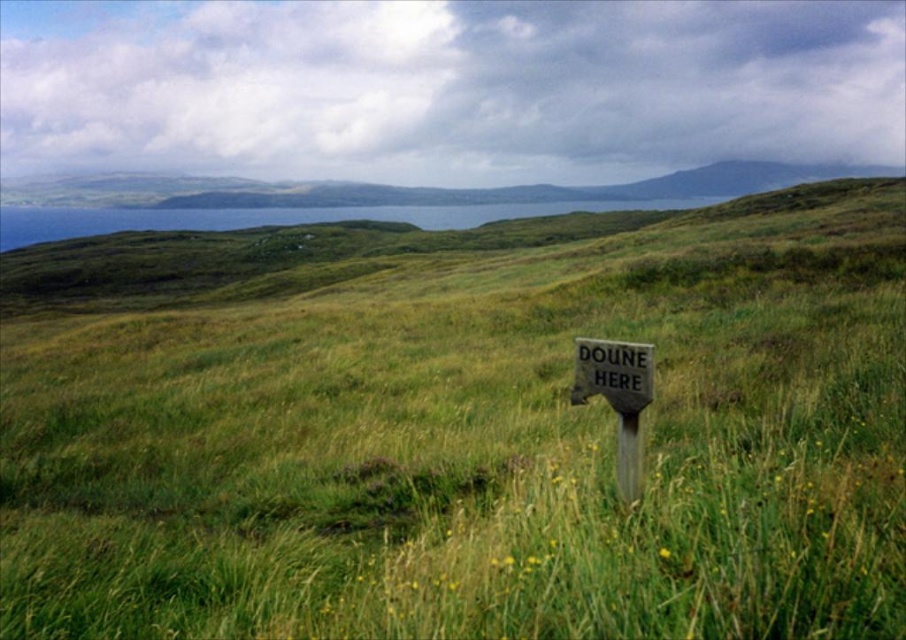
Question: Considering the relative positions of green grassy at center and wooden signpost at center in the image provided, where is green grassy at center located with respect to wooden signpost at center?

Choices:
 (A) right
 (B) left

Answer: (A)

Question: Considering the relative positions of green grassy at center and wooden signpost at center in the image provided, where is green grassy at center located with respect to wooden signpost at center?

Choices:
 (A) left
 (B) right

Answer: (B)

Question: Considering the relative positions of green grassy at center and wooden signpost at center in the image provided, where is green grassy at center located with respect to wooden signpost at center?

Choices:
 (A) above
 (B) below

Answer: (A)